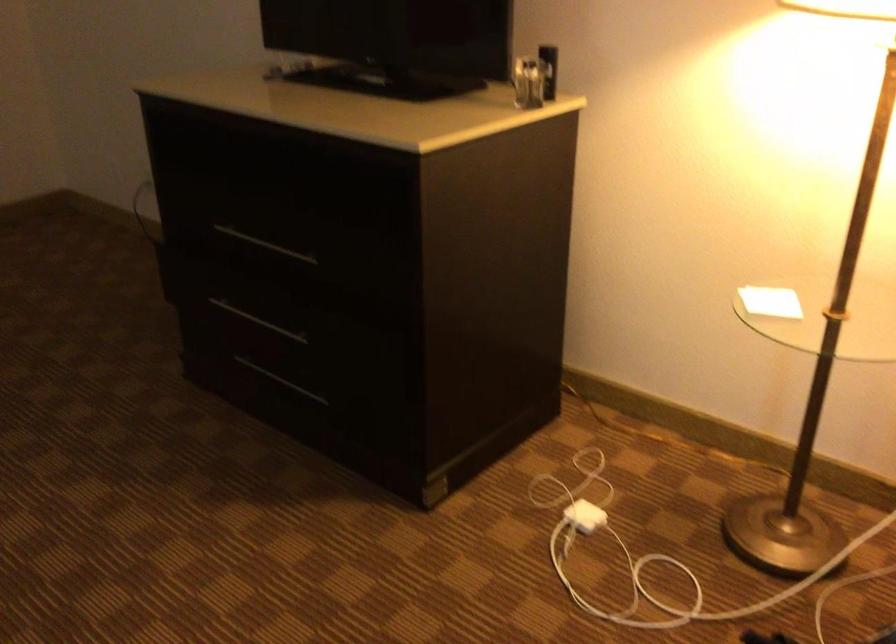
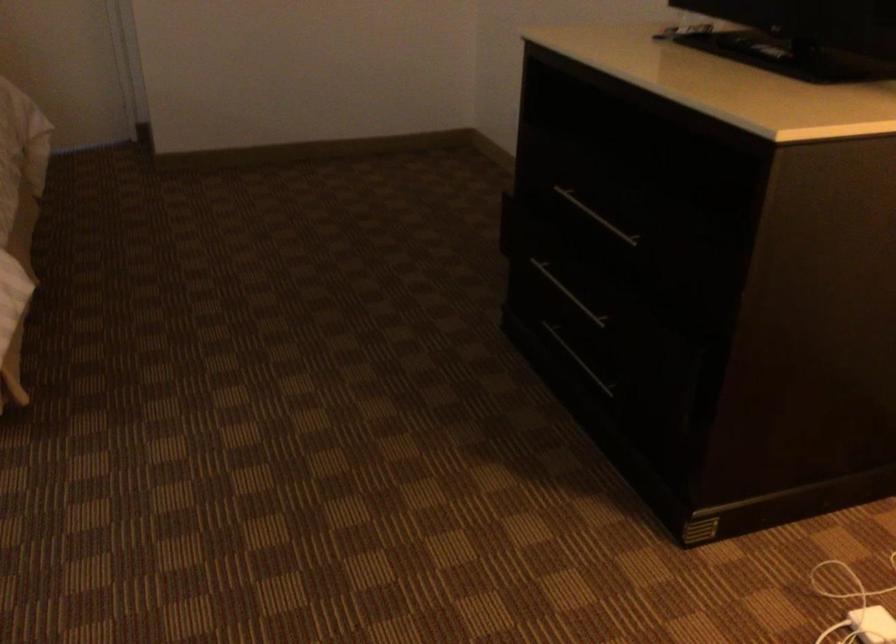
In the second image, find the point that corresponds to (x=264, y=245) in the first image.

(596, 216)